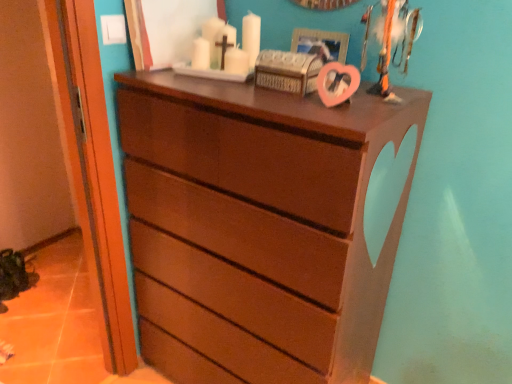
Question: Is pink matte picture frame at upper center smaller than matte wood door at left?

Choices:
 (A) no
 (B) yes

Answer: (B)

Question: Is pink matte picture frame at upper center to the right of matte wood door at left from the viewer's perspective?

Choices:
 (A) yes
 (B) no

Answer: (A)

Question: Is pink matte picture frame at upper center outside matte wood door at left?

Choices:
 (A) no
 (B) yes

Answer: (B)

Question: Is matte wood door at left at the back of pink matte picture frame at upper center?

Choices:
 (A) yes
 (B) no

Answer: (B)

Question: From the image's perspective, is pink matte picture frame at upper center on top of matte wood door at left?

Choices:
 (A) no
 (B) yes

Answer: (B)

Question: From the image's perspective, is metallic silver trophy at upper right positioned above or below matte brown chest of drawers at center?

Choices:
 (A) below
 (B) above

Answer: (B)

Question: Based on their positions, is metallic silver trophy at upper right located to the left or right of matte brown chest of drawers at center?

Choices:
 (A) right
 (B) left

Answer: (A)

Question: Which is correct: metallic silver trophy at upper right is inside matte brown chest of drawers at center, or outside of it?

Choices:
 (A) outside
 (B) inside

Answer: (A)

Question: Considering the positions of metallic silver trophy at upper right and matte brown chest of drawers at center in the image, is metallic silver trophy at upper right taller or shorter than matte brown chest of drawers at center?

Choices:
 (A) tall
 (B) short

Answer: (B)

Question: Considering the relative positions of matte brown chest of drawers at center and metallic silver trophy at upper right in the image provided, is matte brown chest of drawers at center to the left or to the right of metallic silver trophy at upper right?

Choices:
 (A) right
 (B) left

Answer: (B)

Question: Is matte brown chest of drawers at center bigger or smaller than metallic silver trophy at upper right?

Choices:
 (A) small
 (B) big

Answer: (B)

Question: Considering the positions of matte brown chest of drawers at center and metallic silver trophy at upper right in the image, is matte brown chest of drawers at center wider or thinner than metallic silver trophy at upper right?

Choices:
 (A) wide
 (B) thin

Answer: (A)

Question: Choose the correct answer: Is matte brown chest of drawers at center inside metallic silver trophy at upper right or outside it?

Choices:
 (A) inside
 (B) outside

Answer: (B)

Question: Is matte wood door at left bigger or smaller than matte brown chest of drawers at center?

Choices:
 (A) big
 (B) small

Answer: (B)

Question: From their relative heights in the image, would you say matte wood door at left is taller or shorter than matte brown chest of drawers at center?

Choices:
 (A) tall
 (B) short

Answer: (A)